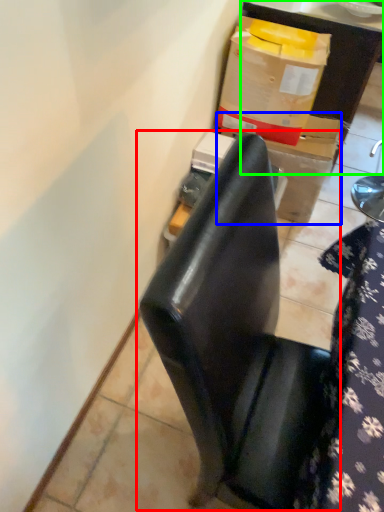
Question: Which object is the closest to the chair (highlighted by a red box)? Choose among these: cardboard box (highlighted by a blue box) or furniture (highlighted by a green box).

Choices:
 (A) cardboard box
 (B) furniture

Answer: (A)